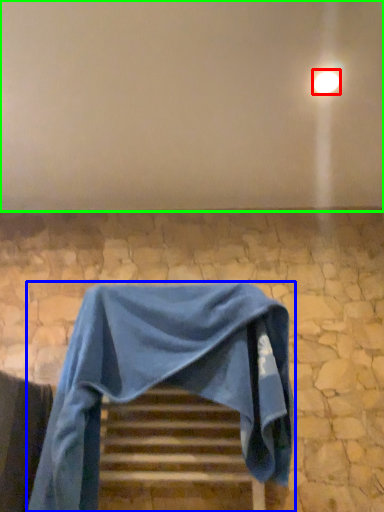
Question: Which object is the farthest from light (highlighted by a red box)? Choose among these: furniture (highlighted by a blue box) or backdrop (highlighted by a green box).

Choices:
 (A) furniture
 (B) backdrop

Answer: (A)